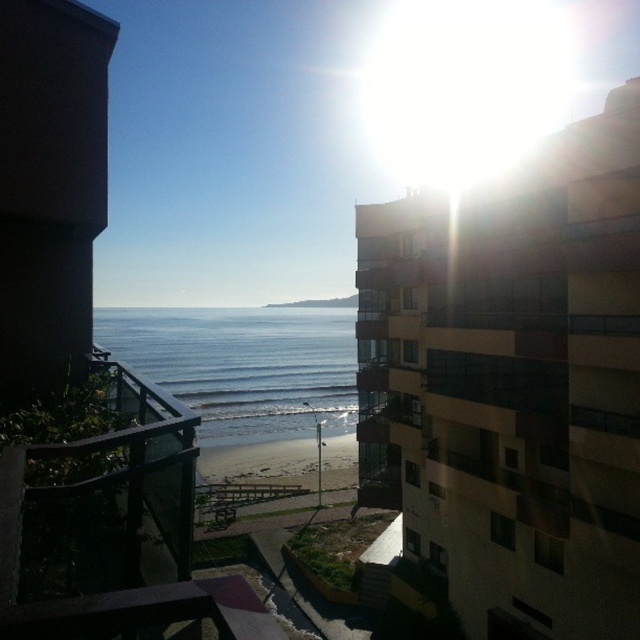
Question: Does glass railing at center appear over blue glassy water at center?

Choices:
 (A) no
 (B) yes

Answer: (A)

Question: Which point appears farthest from the camera in this image?

Choices:
 (A) (211, 500)
 (B) (134, 561)
 (C) (250, 440)

Answer: (C)

Question: Can you confirm if glass railing at center is positioned to the left of blue glassy water at center?

Choices:
 (A) no
 (B) yes

Answer: (A)

Question: Is glass railing at center wider than blue glassy water at center?

Choices:
 (A) no
 (B) yes

Answer: (A)

Question: Which of the following is the farthest from the observer?

Choices:
 (A) glass railing at center
 (B) sandy beach at center
 (C) blue glassy water at center

Answer: (B)

Question: Which point appears closest to the camera in this image?

Choices:
 (A) (150, 419)
 (B) (209, 460)
 (C) (289, 433)

Answer: (A)